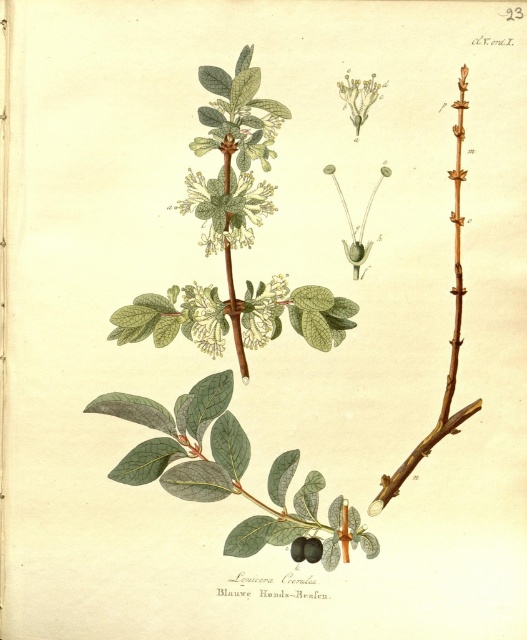
Who is higher up, green matte flower at center or brown matte branch at upper right?

Positioned higher is green matte flower at center.

From the picture: Does green matte flower at center appear on the right side of brown matte branch at upper right?

Incorrect, green matte flower at center is not on the right side of brown matte branch at upper right.

The height and width of the screenshot is (640, 527). I want to click on green matte flower at center, so click(227, 205).

Locate an element on the screen. The height and width of the screenshot is (640, 527). green matte flower at center is located at coordinates (227, 205).

Can you confirm if brown matte branch at upper right is positioned below smooth dark purple fruit at center?

Actually, brown matte branch at upper right is above smooth dark purple fruit at center.

At what (x,y) coordinates should I click in order to perform the action: click on brown matte branch at upper right. Please return your answer as a coordinate pair (x, y). This screenshot has width=527, height=640. Looking at the image, I should click on (452, 336).

Find the location of `brown matte branch at upper right`. brown matte branch at upper right is located at coordinates (452, 336).

Which of these two, shiny purple fruit at center or smooth dark purple fruit at center, stands shorter?

smooth dark purple fruit at center

Does point (307, 556) come farther from viewer compared to point (297, 540)?

That is False.

What do you see at coordinates (311, 548) in the screenshot?
I see `shiny purple fruit at center` at bounding box center [311, 548].

Find the location of `shiny purple fruit at center`. shiny purple fruit at center is located at coordinates (311, 548).